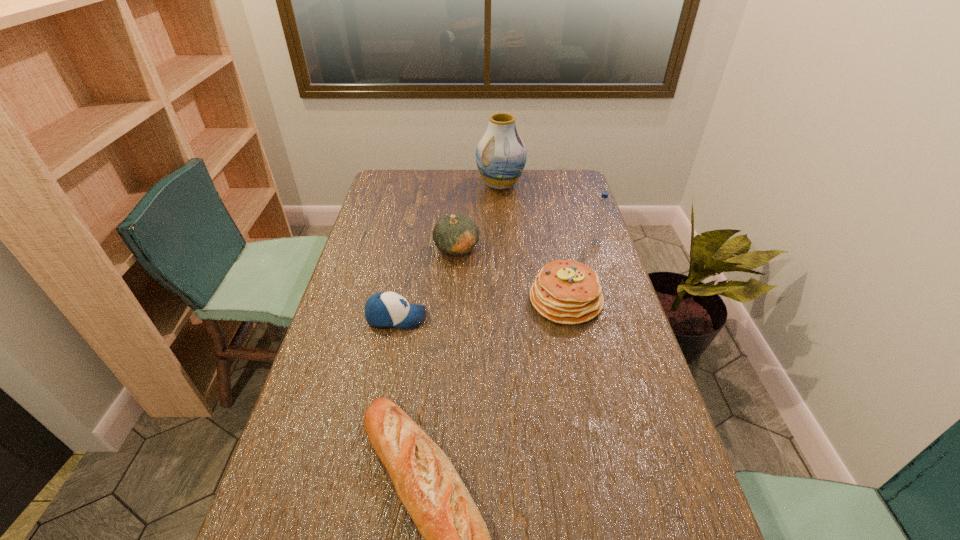
Locate an element on the screen. Image resolution: width=960 pixels, height=540 pixels. blank space located 0.340m on the back of the fourth tallest object is located at coordinates (549, 219).

This screenshot has height=540, width=960. Find the location of `blank area located 0.060m on the front-facing side of the baseball cap`. blank area located 0.060m on the front-facing side of the baseball cap is located at coordinates (446, 318).

The width and height of the screenshot is (960, 540). Find the location of `object present at the far edge`. object present at the far edge is located at coordinates (501, 155).

Identify the location of object that is at the left edge. (387, 309).

Find the location of a particular element. Image resolution: width=960 pixels, height=540 pixels. water bottle at the right edge is located at coordinates (601, 211).

Locate an element on the screen. pancake located in the right edge section of the desktop is located at coordinates (568, 292).

Identify the location of free space at the far edge of the desktop. (456, 177).

This screenshot has height=540, width=960. Find the location of `free space at the left edge of the desktop`. free space at the left edge of the desktop is located at coordinates [x=357, y=283].

At what (x,y) coordinates should I click in order to perform the action: click on free space at the right edge of the desktop. Please return your answer as a coordinate pair (x, y). Looking at the image, I should click on (602, 255).

You are a GUI agent. You are given a task and a screenshot of the screen. Output one action in this format:
    pyautogui.click(x=<x>, y=<y>)
    Task: Click on the free area in between the baseball cap and the pancake
    
    Given the screenshot: What is the action you would take?
    pyautogui.click(x=481, y=309)